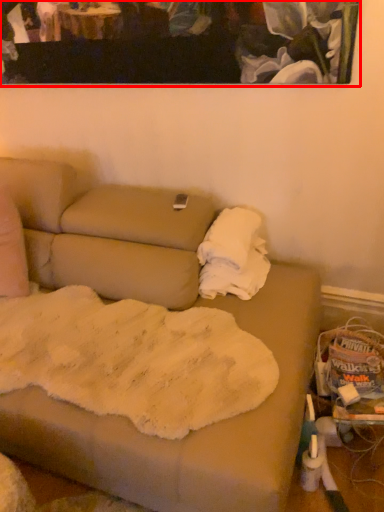
Question: From the image, what is the correct spatial relationship of picture frame (annotated by the red box) in relation to cloth?

Choices:
 (A) right
 (B) left

Answer: (B)